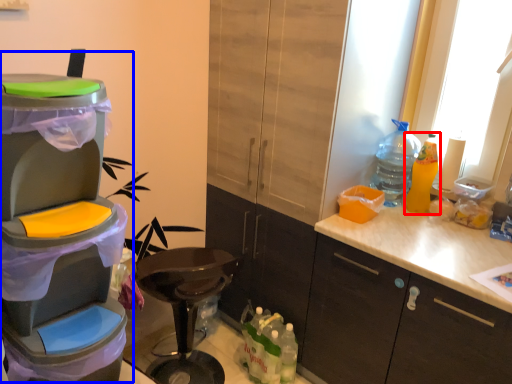
Question: Which point is further to the camera, bottle (highlighted by a red box) or appliance (highlighted by a blue box)?

Choices:
 (A) bottle
 (B) appliance

Answer: (A)